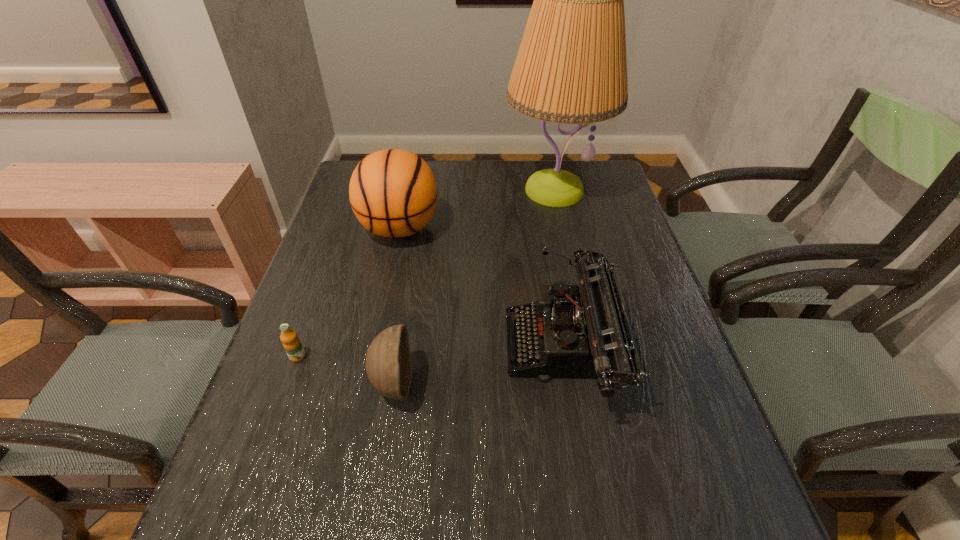
You are a GUI agent. You are given a task and a screenshot of the screen. Output one action in this format:
    pyautogui.click(x=<x>, y=<y>)
    Task: Click on the free space between the lamp and the shortest object
    The width and height of the screenshot is (960, 540).
    Given the screenshot: What is the action you would take?
    pyautogui.click(x=425, y=273)

Locate an element on the screen. free space between the typewriter and the leftmost object is located at coordinates (431, 352).

At what (x,y) coordinates should I click in order to perform the action: click on vacant area that lies between the bowl and the typewriter. Please return your answer as a coordinate pair (x, y). The image size is (960, 540). Looking at the image, I should click on (479, 366).

Locate which object is the closest to the orange juice. Please provide its 2D coordinates. Your answer should be formatted as a tuple, i.e. [(x, y)], where the tuple contains the x and y coordinates of a point satisfying the conditions above.

[(389, 368)]

You are a GUI agent. You are given a task and a screenshot of the screen. Output one action in this format:
    pyautogui.click(x=<x>, y=<y>)
    Task: Click on the object that is the nearest to the lamp
    This screenshot has height=540, width=960.
    Given the screenshot: What is the action you would take?
    tap(393, 193)

Where is `vacant area that satisfies the following two spatial constraints: 1. on the keyboard of the typewriter; 2. on the label of the leftmost object`? Image resolution: width=960 pixels, height=540 pixels. vacant area that satisfies the following two spatial constraints: 1. on the keyboard of the typewriter; 2. on the label of the leftmost object is located at coordinates (565, 356).

Image resolution: width=960 pixels, height=540 pixels. Identify the location of free space that satisfies the following two spatial constraints: 1. on the front side of the basketball; 2. on the right side of the bowl. (367, 383).

The image size is (960, 540). Identify the location of free region that satisfies the following two spatial constraints: 1. on the label of the bowl; 2. on the right side of the leftmost object. (288, 383).